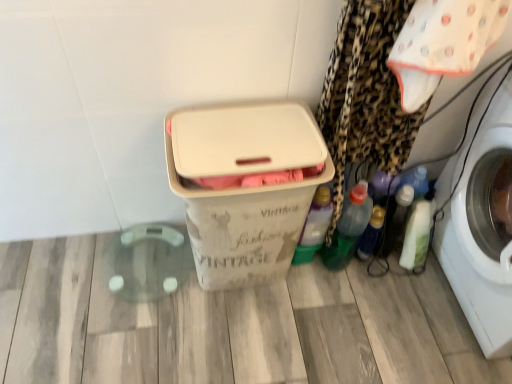
The width and height of the screenshot is (512, 384). What are the coordinates of `spots to the right of beige plastic storage box at center` in the screenshot? It's located at (336, 318).